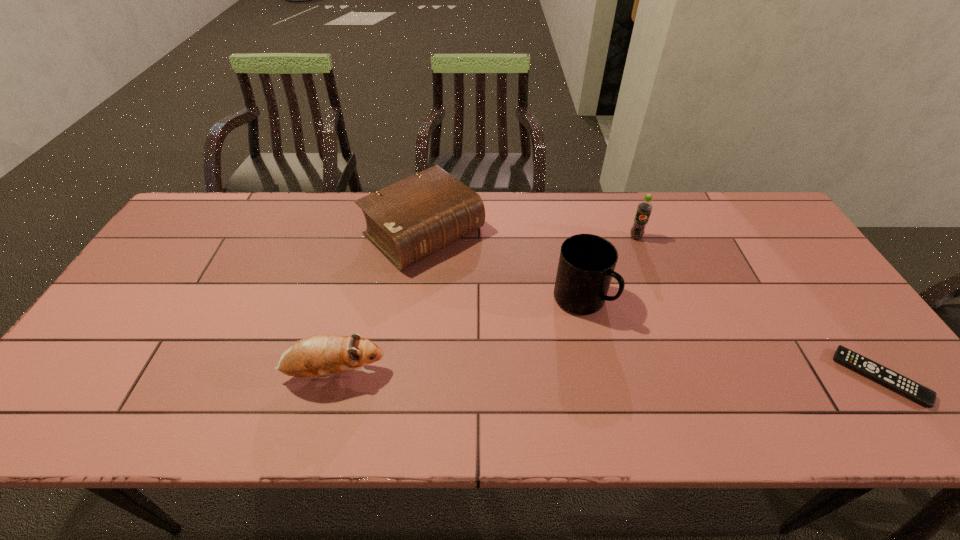
Locate an element on the screen. This screenshot has width=960, height=540. free space located 0.170m on the spine side of the Bible is located at coordinates (500, 300).

Locate an element on the screen. The height and width of the screenshot is (540, 960). free spot located 0.130m on the spine side of the Bible is located at coordinates (491, 291).

You are a GUI agent. You are given a task and a screenshot of the screen. Output one action in this format:
    pyautogui.click(x=<x>, y=<y>)
    Task: Click on the vacant space located 0.100m on the side of the third object from right to left with the handle
    This screenshot has width=960, height=540.
    Given the screenshot: What is the action you would take?
    pyautogui.click(x=635, y=342)

Find the location of a particular element. The image size is (960, 540). vacant space located on the side of the third object from right to left with the handle is located at coordinates (632, 340).

Locate an element on the screen. This screenshot has height=540, width=960. vacant space situated 0.070m on the side of the third object from right to left with the handle is located at coordinates (625, 335).

The height and width of the screenshot is (540, 960). In order to click on vacant space situated on the front label of the fourth object from left to right in this screenshot , I will do point(637,264).

This screenshot has width=960, height=540. I want to click on free spot located 0.300m on the front label of the fourth object from left to right, so click(x=640, y=318).

Locate an element on the screen. This screenshot has width=960, height=540. vacant space located 0.060m on the front label of the fourth object from left to right is located at coordinates (636, 255).

I want to click on Bible situated at the far edge, so click(x=409, y=220).

Image resolution: width=960 pixels, height=540 pixels. Find the location of `soda that is at the far edge`. soda that is at the far edge is located at coordinates [644, 208].